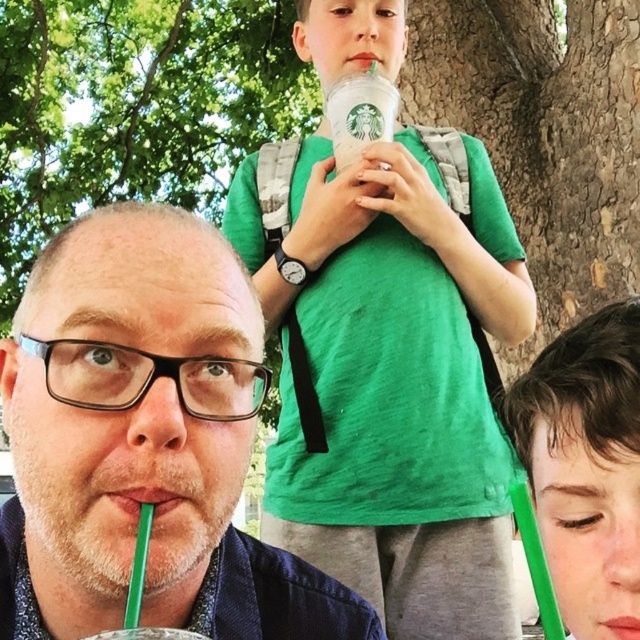
Question: Does green matte shirt at center appear on the right side of matte green straw at upper right?

Choices:
 (A) yes
 (B) no

Answer: (B)

Question: Which point is farther to the camera?

Choices:
 (A) matte black mug at center
 (B) white paper cup at upper center

Answer: (A)

Question: Does matte black mug at center lie in front of white paper cup at upper center?

Choices:
 (A) no
 (B) yes

Answer: (A)

Question: Can you confirm if matte black mug at center is wider than matte green straw at upper right?

Choices:
 (A) no
 (B) yes

Answer: (B)

Question: Among these objects, which one is nearest to the camera?

Choices:
 (A) matte black mug at center
 (B) green matte shirt at center
 (C) white paper cup at upper center

Answer: (C)

Question: Which point is farther to the camera?

Choices:
 (A) matte green straw at upper right
 (B) matte black mug at center

Answer: (B)